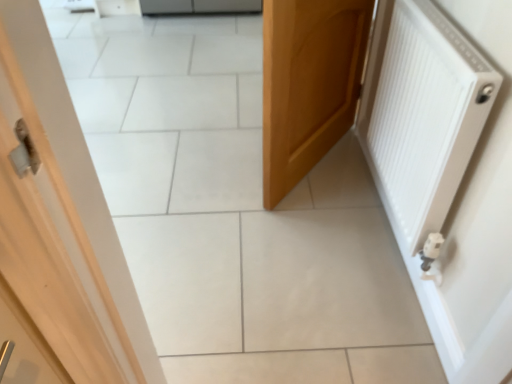
Find the location of a particular element. white matte radiator at right is located at coordinates (424, 113).

Describe the element at coordinates (424, 113) in the screenshot. I see `white matte radiator at right` at that location.

The image size is (512, 384). I want to click on wooden door at center, so click(308, 84).

The image size is (512, 384). Describe the element at coordinates (308, 84) in the screenshot. I see `wooden door at center` at that location.

Find the location of a particular element. This screenshot has height=384, width=512. white matte radiator at right is located at coordinates 424,113.

Based on their positions, is white matte radiator at right located to the left or right of wooden door at center?

white matte radiator at right is to the right of wooden door at center.

Which object is further away from the camera taking this photo, white matte radiator at right or wooden door at center?

wooden door at center is more distant.

Is point (474, 55) closer to camera compared to point (275, 90)?

Yes, it is in front of point (275, 90).

From the image's perspective, is white matte radiator at right under wooden door at center?

Correct, white matte radiator at right appears lower than wooden door at center in the image.

From a real-world perspective, is white matte radiator at right positioned above or below wooden door at center?

white matte radiator at right is above wooden door at center.

Consider the image. In terms of width, does white matte radiator at right look wider or thinner when compared to wooden door at center?

white matte radiator at right is thinner than wooden door at center.

Which of these two, white matte radiator at right or wooden door at center, stands taller?

wooden door at center is taller.

From the picture: Based on their sizes in the image, would you say white matte radiator at right is bigger or smaller than wooden door at center?

white matte radiator at right is smaller than wooden door at center.

Is white matte radiator at right inside or outside of wooden door at center?

white matte radiator at right exists outside the volume of wooden door at center.

Does white matte radiator at right touch wooden door at center?

They are not placed beside each other.

Is wooden door at center at the back of white matte radiator at right?

No, white matte radiator at right's orientation is not away from wooden door at center.

Can you tell me how much white matte radiator at right and wooden door at center differ in facing direction?

white matte radiator at right and wooden door at center are facing 36.2 degrees away from each other.

At what (x,y) coordinates should I click in order to perform the action: click on radiator that is above the wooden door at center (from a real-world perspective). Please return your answer as a coordinate pair (x, y). The width and height of the screenshot is (512, 384). Looking at the image, I should click on (424, 113).

Which object is positioned more to the left, wooden door at center or white matte radiator at right?

Positioned to the left is wooden door at center.

Which object is more forward, wooden door at center or white matte radiator at right?

white matte radiator at right.

Is point (306, 165) positioned in front of point (411, 15)?

No, it is behind (411, 15).

From the image's perspective, is wooden door at center under white matte radiator at right?

No, from the image's perspective, wooden door at center is not beneath white matte radiator at right.

From a real-world perspective, is wooden door at center on top of white matte radiator at right?

Actually, wooden door at center is physically below white matte radiator at right in the real world.

In terms of width, does wooden door at center look wider or thinner when compared to white matte radiator at right?

wooden door at center is wider than white matte radiator at right.

Considering the sizes of wooden door at center and white matte radiator at right in the image, is wooden door at center taller or shorter than white matte radiator at right?

Clearly, wooden door at center is taller compared to white matte radiator at right.

In the scene shown: Who is smaller, wooden door at center or white matte radiator at right?

Smaller between the two is white matte radiator at right.

Do you think wooden door at center is within white matte radiator at right, or outside of it?

wooden door at center lies outside white matte radiator at right.

Is the surface of wooden door at center in direct contact with white matte radiator at right?

wooden door at center and white matte radiator at right are not in contact.

Based on the photo, is wooden door at center aimed at white matte radiator at right?

Yes, wooden door at center is turned towards white matte radiator at right.

Can you tell me how much wooden door at center and white matte radiator at right differ in facing direction?

They differ by 36.2 degrees in their facing directions.

Where is `radiator below the wooden door at center (from the image's perspective)`? This screenshot has height=384, width=512. radiator below the wooden door at center (from the image's perspective) is located at coordinates (424, 113).

Identify the location of door located on the left of white matte radiator at right. (308, 84).

Locate an element on the screen. radiator below the wooden door at center (from the image's perspective) is located at coordinates (424, 113).